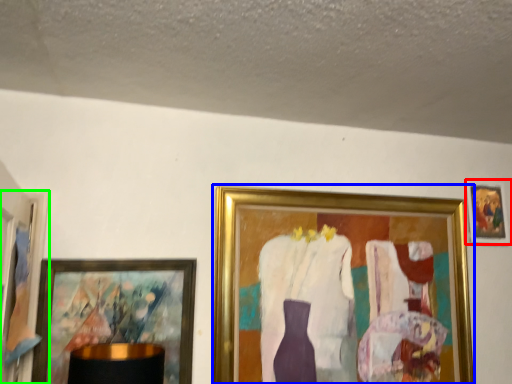
Question: Which is farther away from picture frame (highlighted by a red box)? picture frame (highlighted by a blue box) or picture frame (highlighted by a green box)?

Choices:
 (A) picture frame
 (B) picture frame

Answer: (B)